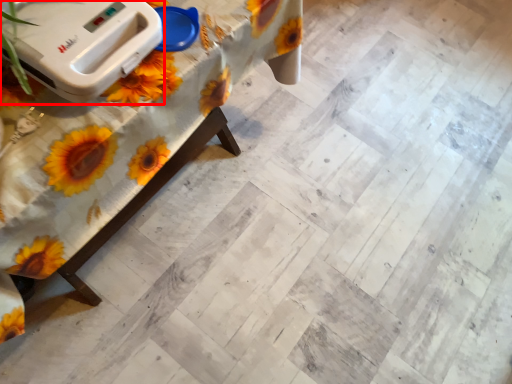
Question: In this image, where is appliance (annotated by the red box) located relative to table?

Choices:
 (A) right
 (B) left

Answer: (A)